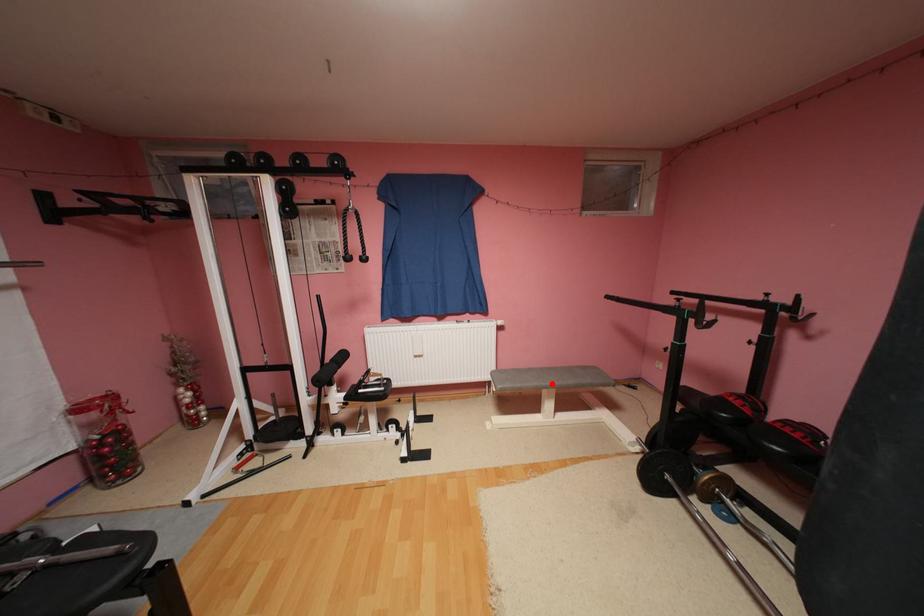
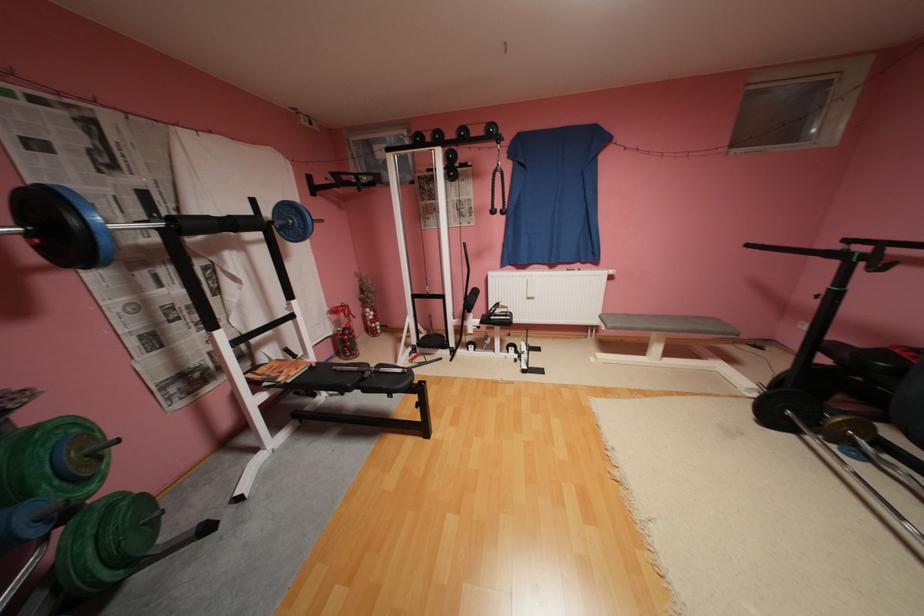
In the second image, find the point that corresponds to the highlighted location in the first image.

(664, 326)